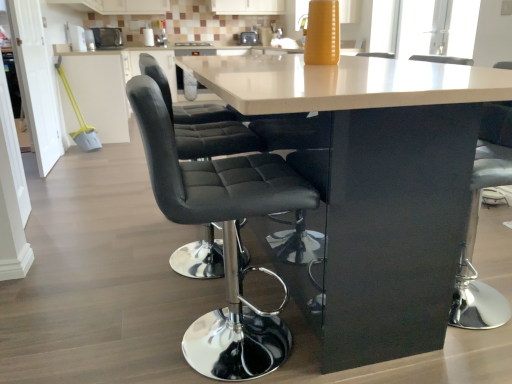
The width and height of the screenshot is (512, 384). I want to click on vacant area on the back side of black leather chair at center, so click(x=220, y=282).